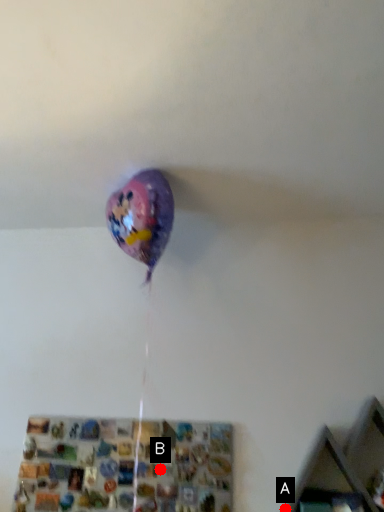
Question: Two points are circled on the image, labeled by A and B beside each circle. Which point is further to the camera?

Choices:
 (A) A is further
 (B) B is further

Answer: (B)